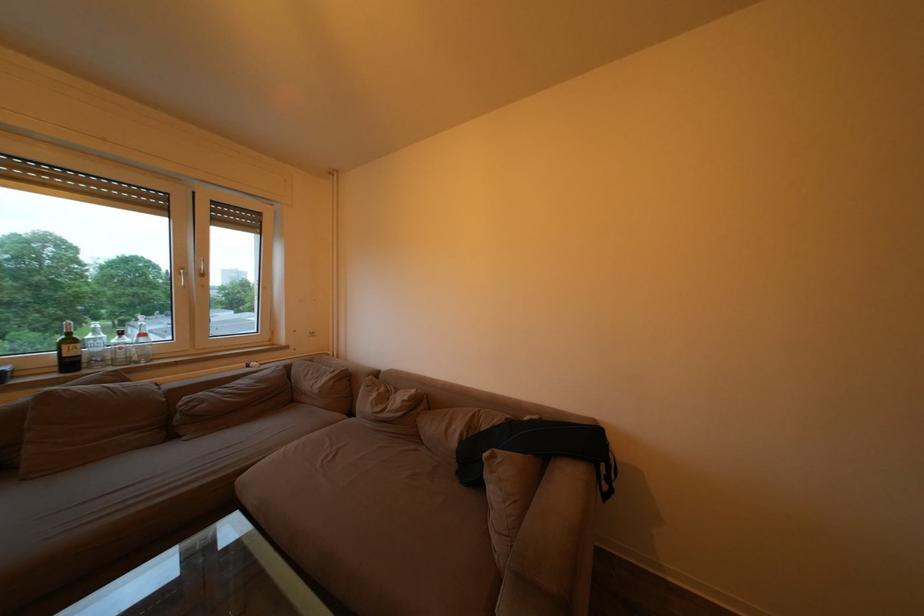
The image size is (924, 616). In order to click on sofa armrest in this screenshot , I will do `click(541, 580)`.